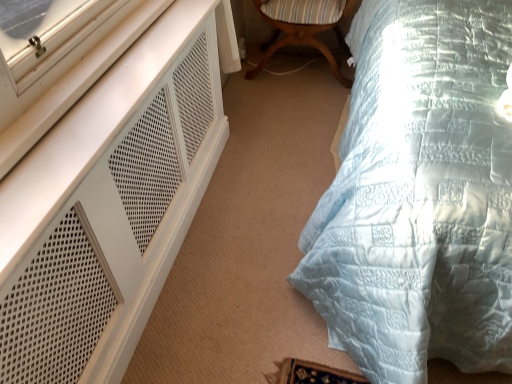
Where is `vacant area located to the right-hand side of white mesh dresser at left`? This screenshot has width=512, height=384. vacant area located to the right-hand side of white mesh dresser at left is located at coordinates (258, 233).